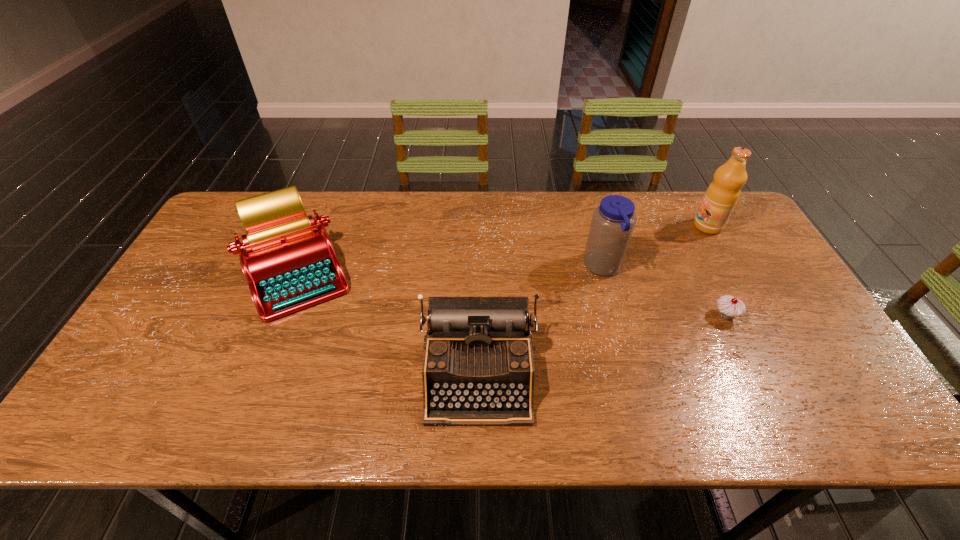
Find the location of `free location located on the front label of the rightmost object`. free location located on the front label of the rightmost object is located at coordinates (580, 226).

Where is `vacant space located 0.380m on the front label of the rightmost object`? The height and width of the screenshot is (540, 960). vacant space located 0.380m on the front label of the rightmost object is located at coordinates (577, 226).

Locate an element on the screen. This screenshot has width=960, height=540. vacant region located 0.150m on the front label of the rightmost object is located at coordinates (647, 226).

Identify the location of vacant area situated with a carrying loop on the side of the third object from left to right. (465, 267).

The image size is (960, 540). Find the location of `vacant space situated 0.330m with a carrying loop on the side of the third object from left to right`. vacant space situated 0.330m with a carrying loop on the side of the third object from left to right is located at coordinates (471, 267).

Identify the location of vacant space located with a carrying loop on the side of the third object from left to right. This screenshot has height=540, width=960. (519, 267).

Image resolution: width=960 pixels, height=540 pixels. In order to click on vacant space situated on the typing side of the farther typewriter in this screenshot , I will do `click(245, 400)`.

This screenshot has width=960, height=540. In order to click on blank area located on the right of the cupcake in this screenshot , I will do `click(802, 315)`.

The image size is (960, 540). Identify the location of fruit juice situated at the far edge. click(721, 196).

This screenshot has height=540, width=960. In order to click on typewriter present at the far edge in this screenshot , I will do `click(289, 265)`.